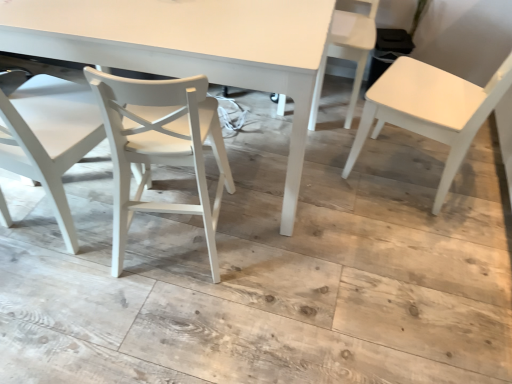
Image resolution: width=512 pixels, height=384 pixels. I want to click on free point to the right of white matte table at center, so click(x=387, y=228).